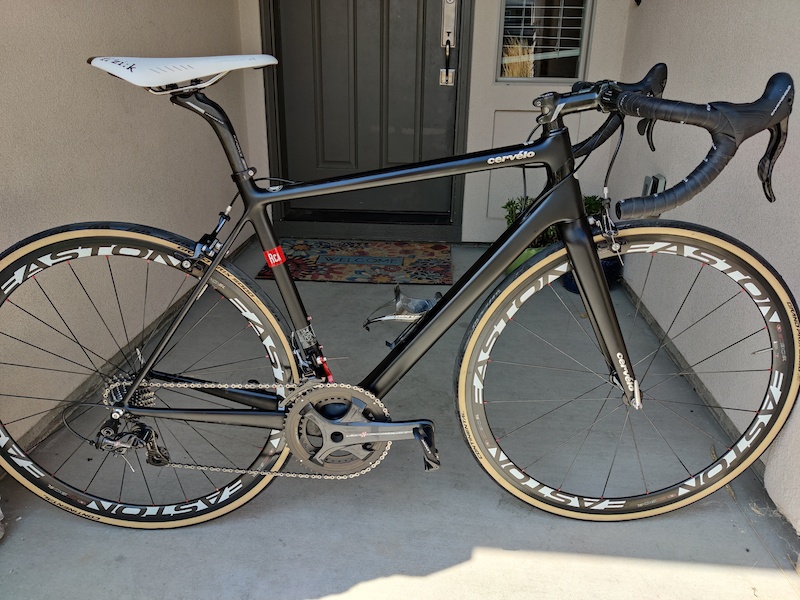
Locate an element on the screen. seat is located at coordinates (134, 73).